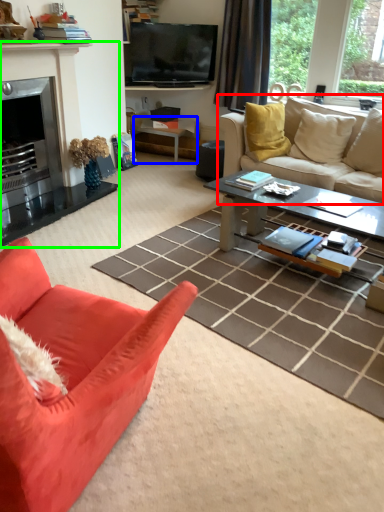
Question: Based on their relative distances, which object is farther from studio couch (highlighted by a red box)? Choose from side table (highlighted by a blue box) and fireplace (highlighted by a green box).

Choices:
 (A) side table
 (B) fireplace

Answer: (B)